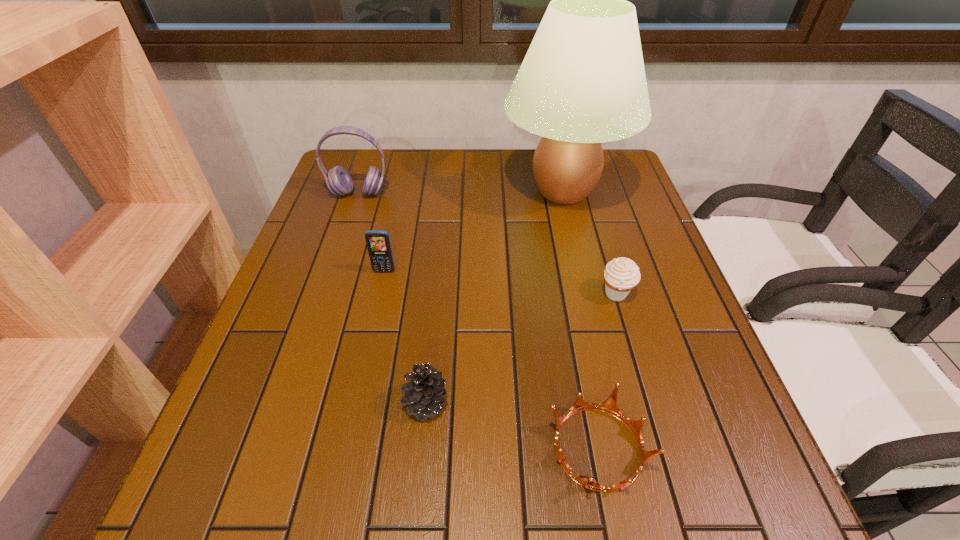
This screenshot has height=540, width=960. What are the coordinates of `blank space at the near right corner of the desktop` in the screenshot? It's located at (763, 505).

At what (x,y) coordinates should I click in order to perform the action: click on free space between the tallest object and the cellular telephone. Please return your answer as a coordinate pair (x, y). The image size is (960, 540). Looking at the image, I should click on (474, 231).

In order to click on free space between the pinecone and the muffin in this screenshot , I will do `click(521, 348)`.

This screenshot has width=960, height=540. What are the coordinates of `unoccupied position between the second object from left to right and the muffin` in the screenshot? It's located at (500, 282).

What are the coordinates of `vacant space that's between the fourth farthest object and the lampshade` in the screenshot? It's located at (589, 242).

Where is `empty location between the pinecone and the fourth farthest object`? The width and height of the screenshot is (960, 540). empty location between the pinecone and the fourth farthest object is located at coordinates (521, 348).

Where is `free space between the crown and the muffin`? This screenshot has height=540, width=960. free space between the crown and the muffin is located at coordinates (607, 371).

The height and width of the screenshot is (540, 960). Identify the location of vacant space that's between the lampshade and the third object from left to right. (494, 297).

Identify the location of vacant area that lies between the lampshade and the second tallest object. (461, 192).

You are a GUI agent. You are given a task and a screenshot of the screen. Output one action in this format:
    pyautogui.click(x=<x>, y=<y>)
    Task: Click on the free space between the lampshade and the cellular telephone
    
    Given the screenshot: What is the action you would take?
    pyautogui.click(x=474, y=231)